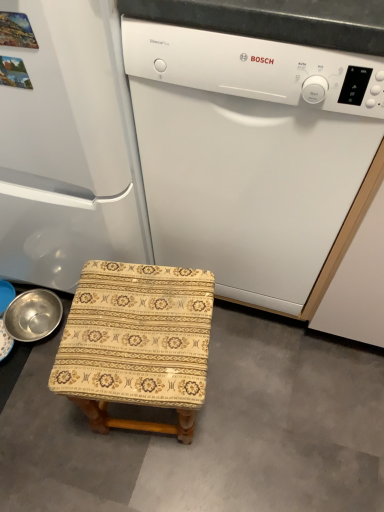
I want to click on free space above patterned fabric stool at center (from a real-world perspective), so click(x=138, y=327).